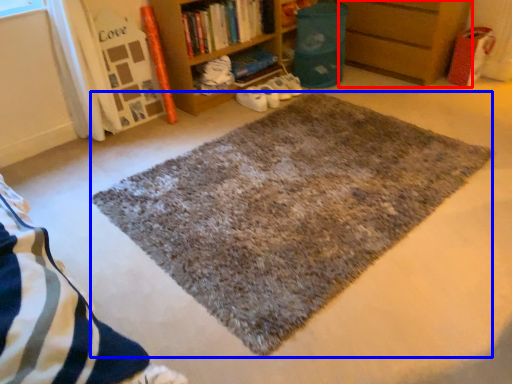
Question: Which point is further to the camera, shelf (highlighted by a red box) or mat (highlighted by a blue box)?

Choices:
 (A) shelf
 (B) mat

Answer: (A)